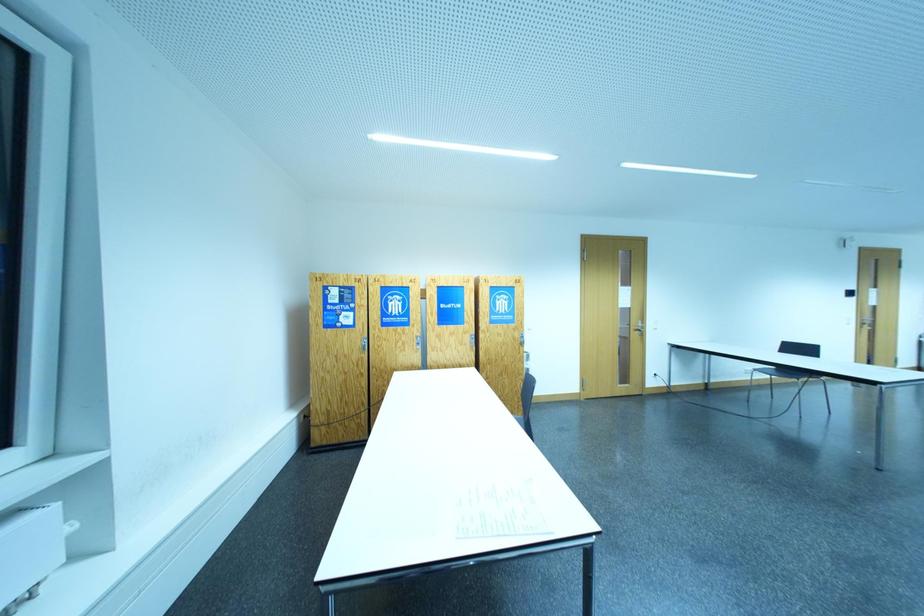
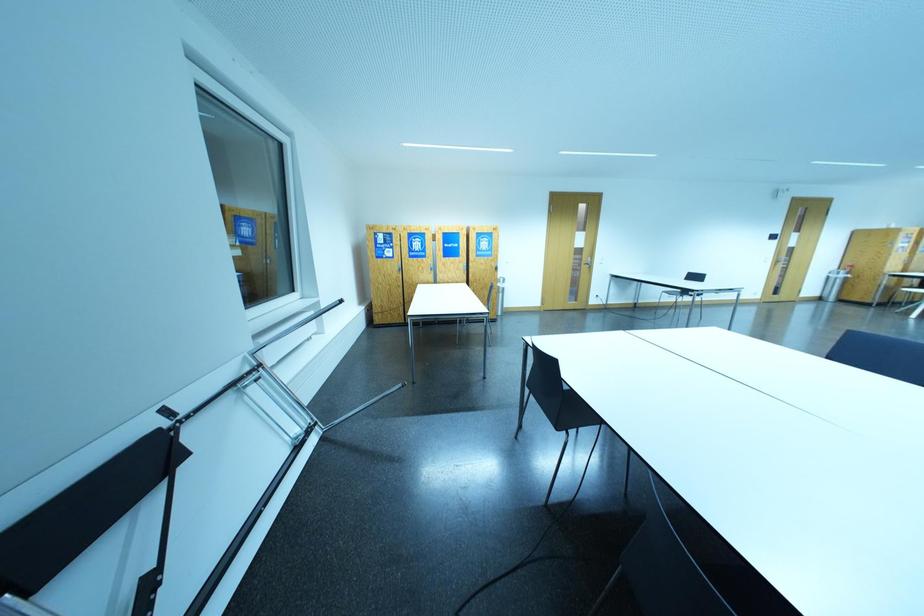
Question: What movement of the cameraman would produce the second image?

Choices:
 (A) Left
 (B) Right
 (C) Forward
 (D) Backward

Answer: (D)